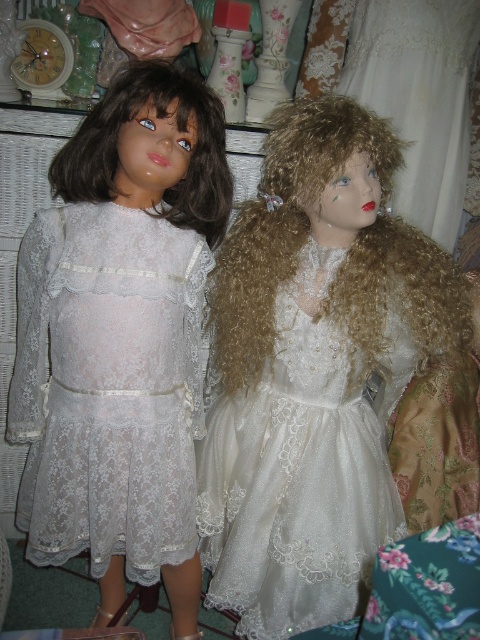
Question: Does lace fabric dress at left have a lesser width compared to white satin dress at center?

Choices:
 (A) yes
 (B) no

Answer: (A)

Question: Can you confirm if lace fabric dress at left is wider than white satin dress at center?

Choices:
 (A) no
 (B) yes

Answer: (A)

Question: Does lace fabric dress at left appear on the left side of white satin dress at center?

Choices:
 (A) no
 (B) yes

Answer: (B)

Question: Which of the following is the farthest from the observer?

Choices:
 (A) (327, 257)
 (B) (145, 429)

Answer: (A)

Question: Which point is closer to the camera taking this photo?

Choices:
 (A) (285, 420)
 (B) (149, 388)

Answer: (B)

Question: Among these points, which one is farthest from the camera?

Choices:
 (A) (23, 518)
 (B) (250, 614)

Answer: (A)